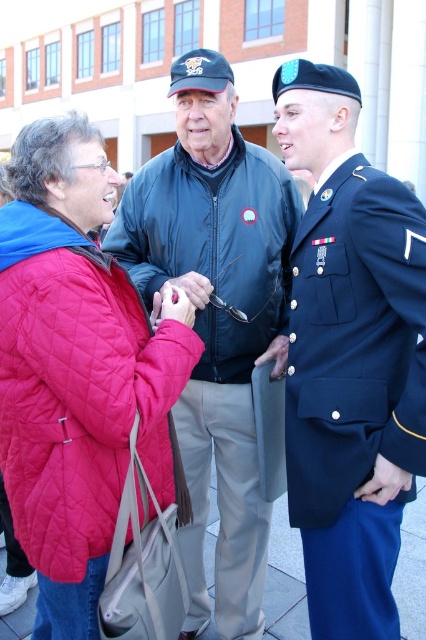
Who is more forward, (118, 484) or (152, 280)?

Point (118, 484) is in front.

Between quilted red jacket at left and dark blue quilted jacket at center, which one has less height?

quilted red jacket at left

Locate an element on the screen. The image size is (426, 640). quilted red jacket at left is located at coordinates (77, 388).

Can you confirm if matte black jacket at center is bigger than dark blue quilted jacket at center?

Indeed, matte black jacket at center has a larger size compared to dark blue quilted jacket at center.

Between matte black jacket at center and dark blue quilted jacket at center, which one is positioned higher?

dark blue quilted jacket at center is above.

Describe the element at coordinates (216, 317) in the screenshot. I see `matte black jacket at center` at that location.

At what (x,y) coordinates should I click in order to perform the action: click on matte black jacket at center. Please return your answer as a coordinate pair (x, y). Image resolution: width=426 pixels, height=640 pixels. Looking at the image, I should click on (216, 317).

Who is more forward, (417, 442) or (34, 392)?

Point (34, 392) is more forward.

Does navy blue fabric uniform at right have a smaller size compared to quilted red jacket at left?

No, navy blue fabric uniform at right is not smaller than quilted red jacket at left.

Locate an element on the screen. navy blue fabric uniform at right is located at coordinates (x=354, y=388).